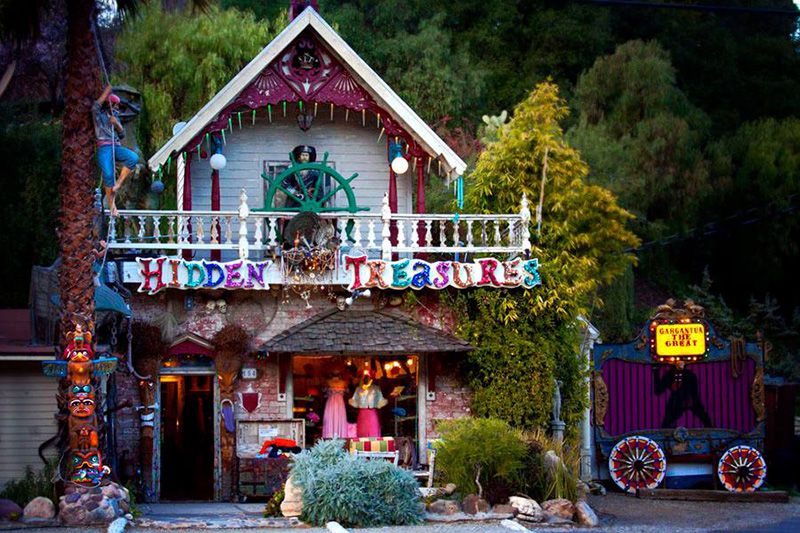
The image size is (800, 533). Identify the location of statue. (557, 403).